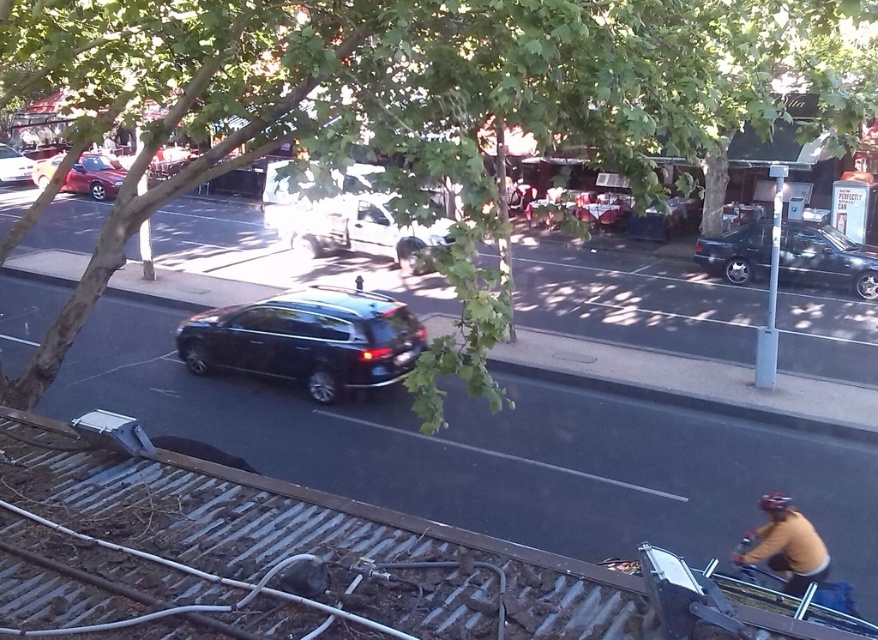
You are a drone operator trying to capture a photo of the green leafy tree at upper center and the matte brown helmet at lower right. To ensure both are in frame, should you adjust your drone to look upward or downward?

The green leafy tree at upper center is positioned over the matte brown helmet at lower right, so you should adjust your drone to look downward to capture both in frame.

You are a delivery person standing on the roof and need to place a package on the brown leather jacket at lower right. The glossy black suv at center is blocking your path. Which direction should you move to avoid the suv?

The glossy black suv at center is to the left of the brown leather jacket at lower right, so you should move to the right side of the suv to reach the brown leather jacket at lower right without obstruction.

You are standing at point A located at coordinates (360, 230) on the street. What object is exactly at your current location?

The white matte van at center is exactly at point A located at coordinates (360, 230) on the street.